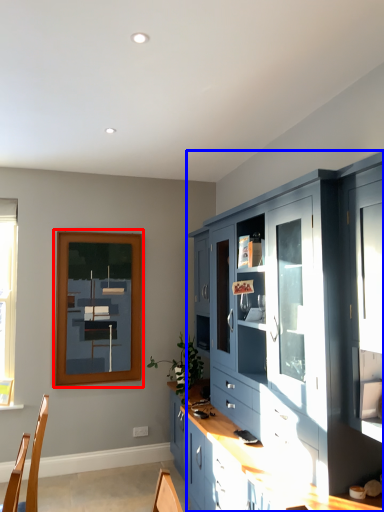
Question: Which point is closer to the camera, picture frame (highlighted by a red box) or cabinetry (highlighted by a blue box)?

Choices:
 (A) picture frame
 (B) cabinetry

Answer: (B)